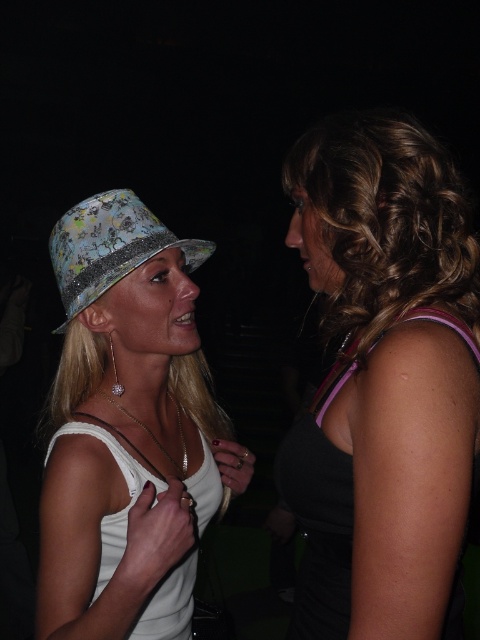
Question: Observing the image, what is the correct spatial positioning of shiny floral hat at left in reference to glittery floral hat at left?

Choices:
 (A) right
 (B) left

Answer: (A)

Question: Is shiny floral hat at left smaller than shiny brown hair at upper right?

Choices:
 (A) no
 (B) yes

Answer: (A)

Question: Which object is the farthest from the shiny black dress at right?

Choices:
 (A) glittery floral hat at left
 (B) shiny brown hair at upper right

Answer: (A)

Question: Is shiny floral hat at left thinner than white fabric dress at center?

Choices:
 (A) no
 (B) yes

Answer: (A)

Question: Among these objects, which one is farthest from the camera?

Choices:
 (A) shiny black dress at right
 (B) shiny brown hair at upper right
 (C) glittery floral hat at left

Answer: (C)

Question: Among these objects, which one is farthest from the camera?

Choices:
 (A) shiny brown hair at upper right
 (B) shiny black dress at right
 (C) white fabric dress at center
 (D) glittery floral hat at left

Answer: (D)